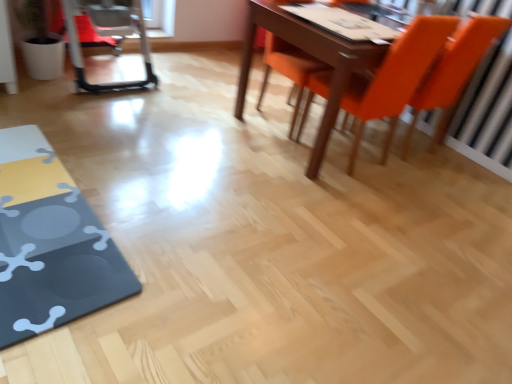
Question: Relative to matte black table at lower left, is orange matte chair at upper right, acting as the second chair starting from the left, in front or behind?

Choices:
 (A) front
 (B) behind

Answer: (B)

Question: Considering the positions of point (425, 34) and point (35, 230), is point (425, 34) closer or farther from the camera than point (35, 230)?

Choices:
 (A) farther
 (B) closer

Answer: (A)

Question: Considering the real-world distances, which object is closest to the matte black table at lower left?

Choices:
 (A) metallic silver swivel chair at left
 (B) orange matte chair at right, which is the third chair from left to right
 (C) orange matte chair at upper right, acting as the second chair starting from the left
 (D) orange matte chair at upper right, the 1th chair when ordered from left to right

Answer: (A)

Question: Which of these objects is positioned closest to the orange matte chair at right, the first chair in the right-to-left sequence?

Choices:
 (A) orange matte chair at upper right, which appears as the third chair when viewed from the right
 (B) orange matte chair at upper right, the 2th chair positioned from the right
 (C) matte black table at lower left
 (D) metallic silver swivel chair at left

Answer: (B)